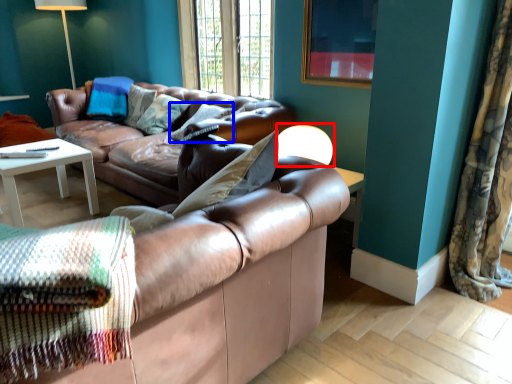
Question: Which of the following is the closest to the observer, table lamp (highlighted by a red box) or pillow (highlighted by a blue box)?

Choices:
 (A) table lamp
 (B) pillow

Answer: (A)